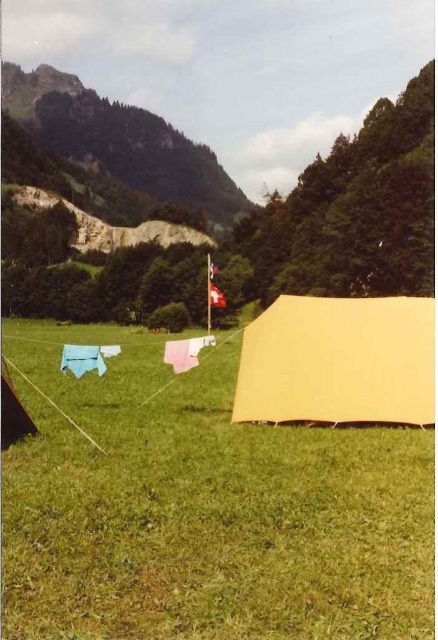
Between yellow fabric tent at right and blue fabric at lower left, which one appears on the right side from the viewer's perspective?

Positioned to the right is yellow fabric tent at right.

Is yellow fabric tent at right shorter than blue fabric at lower left?

No, yellow fabric tent at right is not shorter than blue fabric at lower left.

Where is `yellow fabric tent at right`? This screenshot has width=438, height=640. yellow fabric tent at right is located at coordinates (202, 508).

From the picture: Can you confirm if beige fabric tent at center is shorter than red fabric flag at center?

Yes, beige fabric tent at center is shorter than red fabric flag at center.

This screenshot has width=438, height=640. Describe the element at coordinates (339, 362) in the screenshot. I see `beige fabric tent at center` at that location.

You are a GUI agent. You are given a task and a screenshot of the screen. Output one action in this format:
    pyautogui.click(x=<x>, y=<y>)
    Task: Click on the beige fabric tent at center
    The height and width of the screenshot is (640, 438).
    Given the screenshot: What is the action you would take?
    pyautogui.click(x=339, y=362)

Locate an element on the screen. beige fabric tent at center is located at coordinates (339, 362).

Can you confirm if blue fabric at lower left is smaller than pink fabric at center?

Yes.

Where is `blue fabric at lower left`? This screenshot has height=640, width=438. blue fabric at lower left is located at coordinates (87, 358).